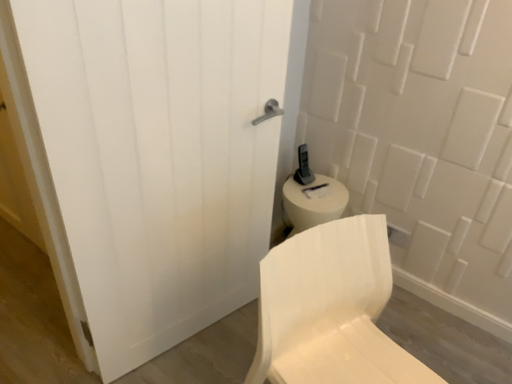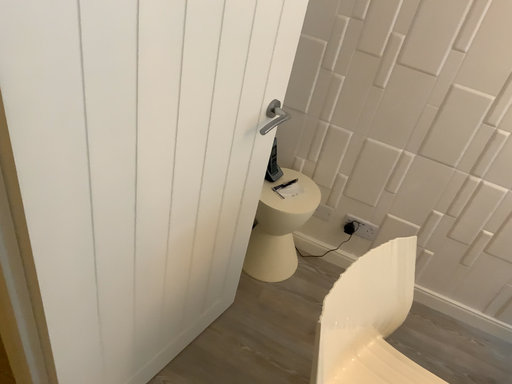
Question: Which way did the camera rotate in the video?

Choices:
 (A) rotated right
 (B) rotated left

Answer: (A)